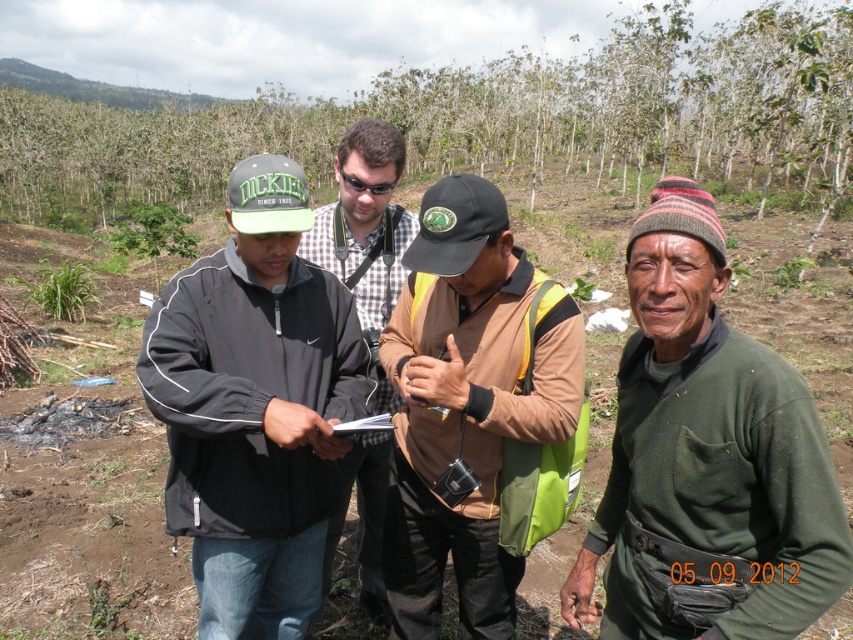
You are a drone operator tasked with capturing aerial footage of the plantation. Your drone is currently at a position above the black matte jacket at center. You need to fly it to the point at coordinates 0.5, 0.5. Can you determine if the drone will pass over any of the young trees in the plantation during its flight path? Please explain your reasoning based on the scene description.

The black matte jacket at center is located at coordinates (256, 408). The target coordinates are (426, 320). The flight path would move the drone from the right side towards the center of the image. The scene description mentions rows of young trees in the background, but their exact positions aren not specified. Since the jacket is in the foreground near the lower center, the drone path might pass over open ground between the trees unless the saplings are densely planted. However, without precise tree row

In the scene shown: You are a safety inspector observing the scene. You notice the black matte jacket at center and the black plastic goggles at center. According to safety protocols, protective gear like goggles should be worn above the jacket to ensure proper visibility. Is the current arrangement compliant with safety standards?

The black matte jacket at center is positioned under black plastic goggles at center, which means the goggles are above the jacket. This placement aligns with safety protocols requiring protective gear like goggles to be worn above the jacket for proper visibility, so the arrangement is compliant.